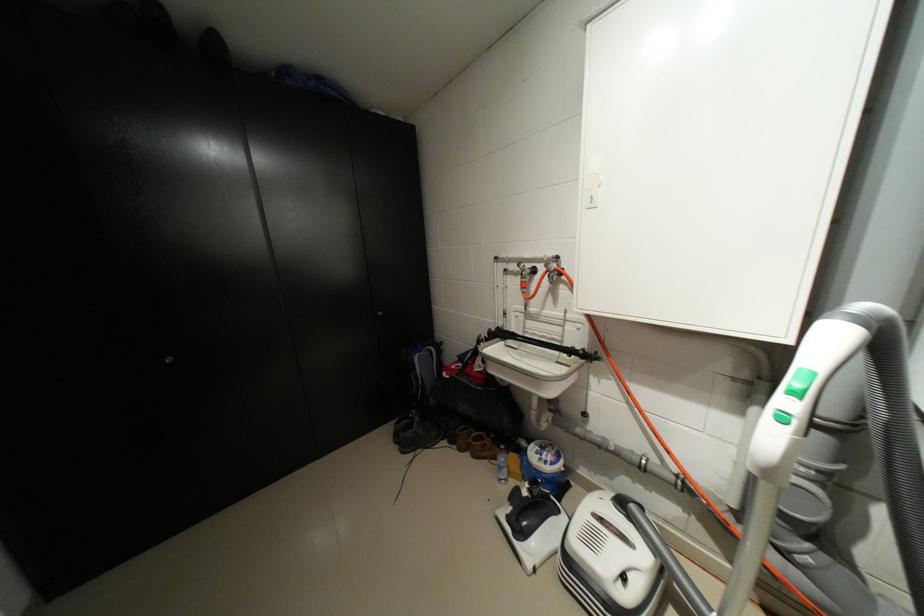
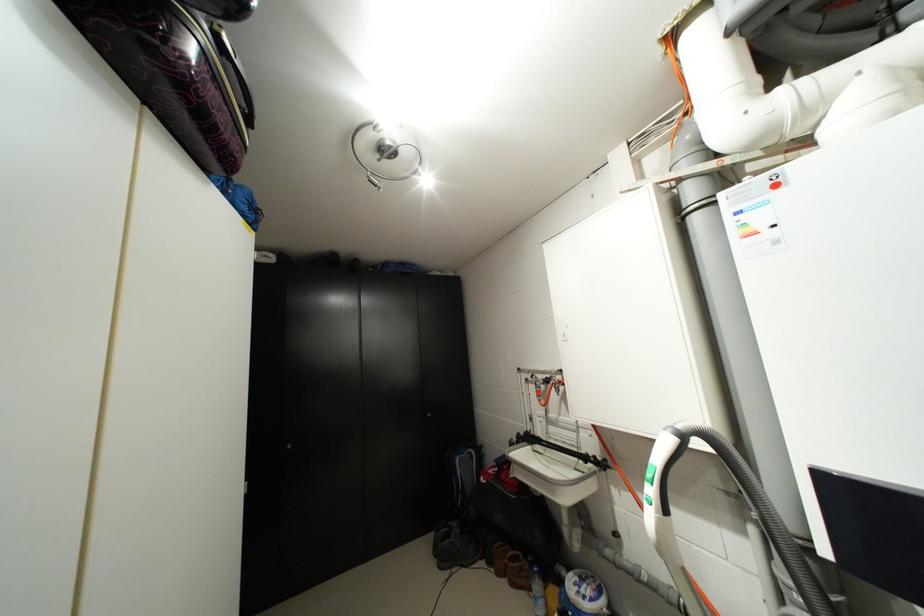
In a continuous first-person perspective shot, in which direction is the camera moving?

The cameraman moved toward right, backward.